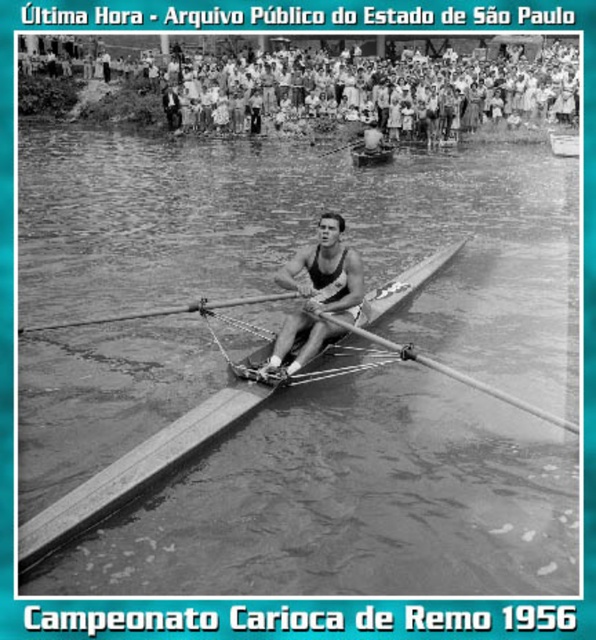
You are a photographer who wants to capture the wooden smooth oar at center and the smooth wood boat at center in a single shot. Based on their positions, which object will appear larger in your photo?

The wooden smooth oar at center is closer to the viewer than the smooth wood boat at center, so the wooden smooth oar at center will appear larger in the photo.